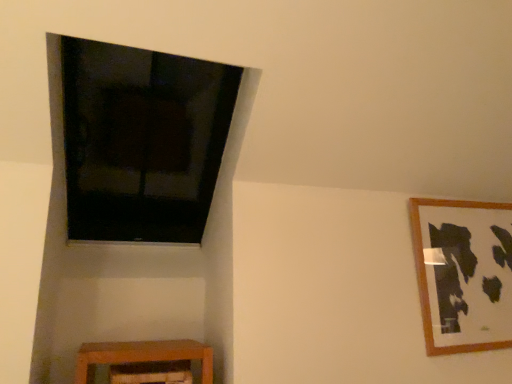
Identify the location of wooden picture frame at upper right. (x=463, y=274).

In order to face wooden picture frame at upper right, should I rotate leftwards or rightwards?

Turn right approximately 27.418 degrees to face it.

What do you see at coordinates (463, 274) in the screenshot? I see `wooden picture frame at upper right` at bounding box center [463, 274].

Locate an element on the screen. Image resolution: width=512 pixels, height=384 pixels. wooden picture frame at upper right is located at coordinates (463, 274).